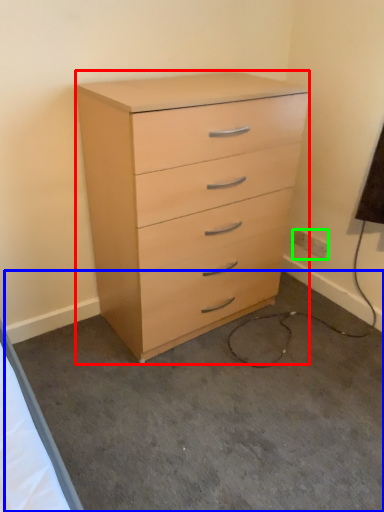
Question: Which object is the farthest from chest of drawers (highlighted by a red box)? Choose among these: concrete (highlighted by a blue box) or electric outlet (highlighted by a green box).

Choices:
 (A) concrete
 (B) electric outlet

Answer: (B)